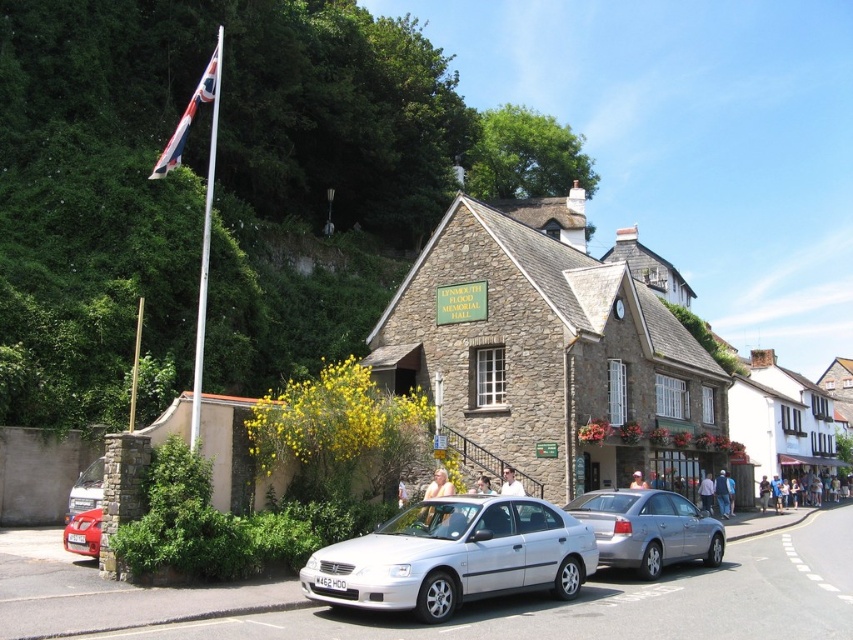
Between point (363, 564) and point (195, 104), which one is positioned behind?

The point (195, 104) is behind.

Does silver metallic car at center lie in front of union jack fabric flag at upper left?

Yes, silver metallic car at center is in front of union jack fabric flag at upper left.

Find the location of a particular element. This screenshot has width=853, height=640. silver metallic car at center is located at coordinates (454, 556).

Can you confirm if silver metallic car at center is thinner than silver metallic sedan at center?

In fact, silver metallic car at center might be wider than silver metallic sedan at center.

Does silver metallic car at center come behind silver metallic sedan at center?

That is False.

Does point (485, 593) come behind point (572, 500)?

No.

Image resolution: width=853 pixels, height=640 pixels. Find the location of `silver metallic car at center`. silver metallic car at center is located at coordinates 454,556.

Is metallic silver sedan at center to the left of silver metallic car at lower left from the viewer's perspective?

Incorrect, metallic silver sedan at center is not on the left side of silver metallic car at lower left.

Measure the distance between point (86, 525) and camera.

Point (86, 525) is 126.49 feet from camera.

Which is in front, point (80, 538) or point (99, 497)?

Positioned in front is point (80, 538).

Find the location of a particular element. metallic silver sedan at center is located at coordinates (83, 532).